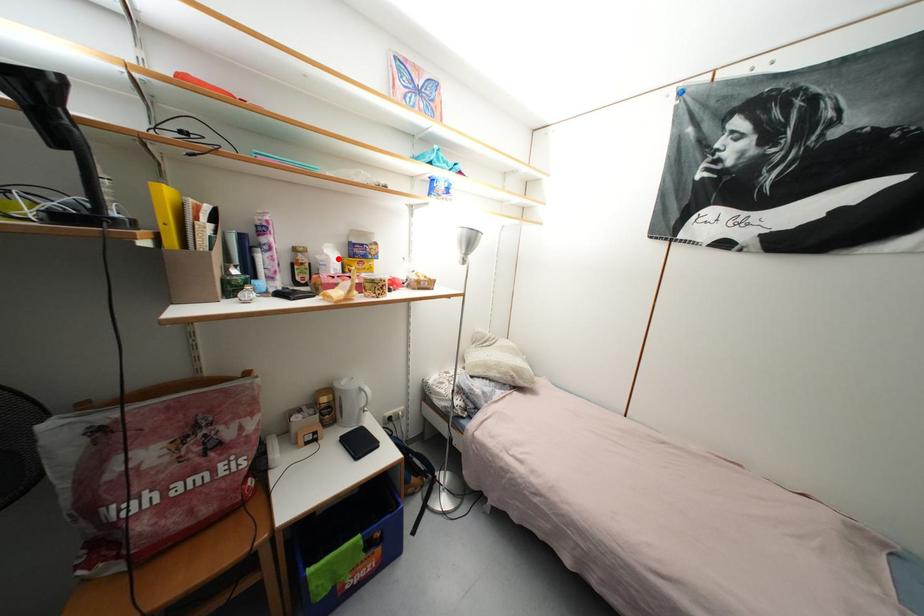
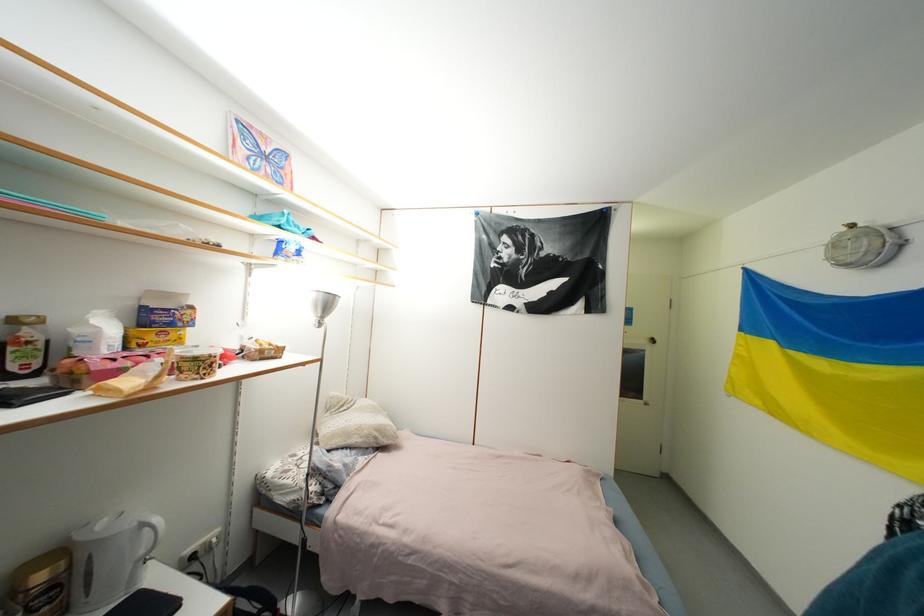
The point at the highlighted location is marked in the first image. Where is the corresponding point in the second image?

(112, 331)